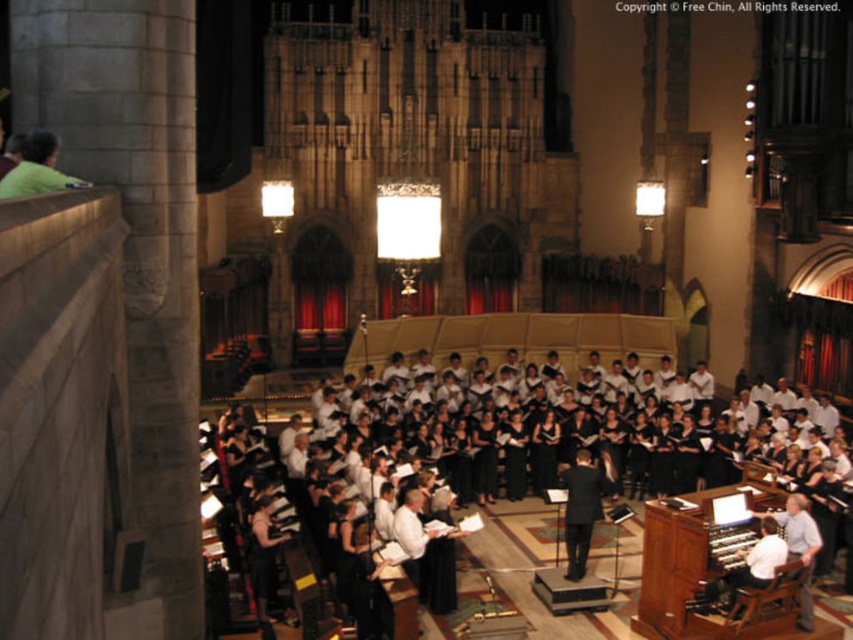
You are a photographer trying to capture a clear photo of the black fabric choir at center and the black suit at center during the performance. Which one appears larger in the photo?

The black fabric choir at center appears larger in the photo because it is much taller than the black suit at center.

You are a stagehand who needs to pass a microphone to the conductor wearing the green matte shirt at upper left from the black fabric choir at center. Given that you can throw the microphone up to 100 feet, will you be able to reach him?

The distance between the black fabric choir at center and the green matte shirt at upper left is 107.44 feet, which exceeds your throwing range of 100 feet. You won t be able to reach him by throwing.